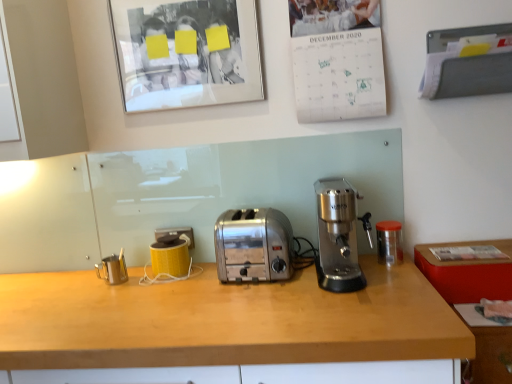
Question: Considering the positions of yellow plastic electric outlet at lower left and brushed metal milk frother at left, which appears as the first appliance when viewed from the left, in the image, is yellow plastic electric outlet at lower left taller or shorter than brushed metal milk frother at left, which appears as the first appliance when viewed from the left,?

Choices:
 (A) tall
 (B) short

Answer: (B)

Question: Looking at the image, does yellow plastic electric outlet at lower left seem bigger or smaller compared to brushed metal milk frother at left, which appears as the first appliance when viewed from the left?

Choices:
 (A) small
 (B) big

Answer: (A)

Question: Estimate the real-world distances between objects in this image. Which object is closer to the yellow plastic electric outlet at lower left?

Choices:
 (A) yellow matte mug at center, the second appliance in the left-to-right sequence
 (B) wooden desk at center
 (C) matte glass picture frame at upper left
 (D) brushed metal milk frother at left, which appears as the first appliance when viewed from the left
 (E) wooden countertop at lower right

Answer: (A)

Question: Estimate the real-world distances between objects in this image. Which object is closer to the brushed metal milk frother at left, the third appliance positioned from the right?

Choices:
 (A) satin silver coffee maker at center
 (B) matte glass picture frame at upper left
 (C) wooden desk at center
 (D) yellow matte mug at center, the second appliance in the left-to-right sequence
 (E) transparent plastic container at right, which ranks as the 3th appliance in left-to-right order

Answer: (D)